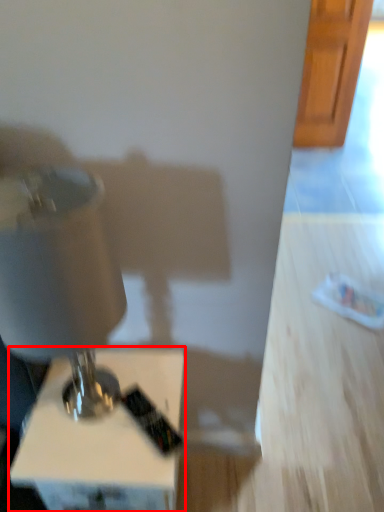
Question: Observing the image, what is the correct spatial positioning of furniture (annotated by the red box) in reference to sewing machine?

Choices:
 (A) right
 (B) left

Answer: (A)